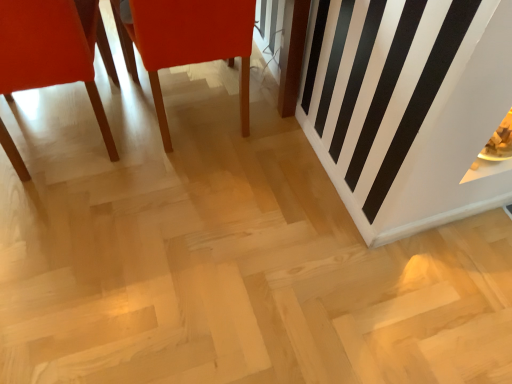
At what (x,y) coordinates should I click in order to perform the action: click on free space in front of matte orange chair at left, which is the second chair in right-to-left order. Please return your answer as a coordinate pair (x, y). Looking at the image, I should click on coord(81,243).